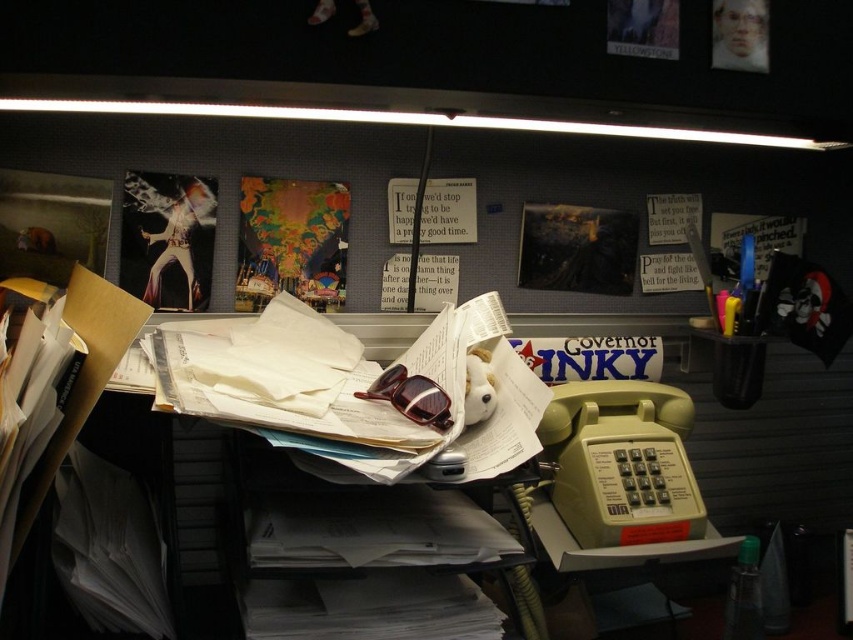
Question: Does beige plastic telephone at right appear on the left side of matte paper poster at center?

Choices:
 (A) yes
 (B) no

Answer: (B)

Question: Can you confirm if beige plastic telephone at right is positioned to the right of shiny silver poster at upper left?

Choices:
 (A) no
 (B) yes

Answer: (B)

Question: Is shiny silver poster at upper left above matte black poster at center?

Choices:
 (A) yes
 (B) no

Answer: (B)

Question: Which object is positioned closest to the matte black poster at center?

Choices:
 (A) beige plastic telephone at right
 (B) vibrant paper poster at center
 (C) matte paper poster at center
 (D) beige plastic telephone at lower right

Answer: (C)

Question: Which point is closer to the camera taking this photo?

Choices:
 (A) (549, 410)
 (B) (460, 221)
 (C) (209, 289)

Answer: (A)

Question: Which object appears farthest from the camera in this image?

Choices:
 (A) matte black poster at center
 (B) shiny silver poster at upper left
 (C) matte paper poster at center

Answer: (A)